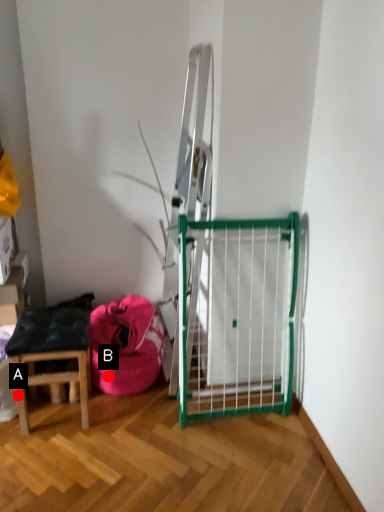
Question: Two points are circled on the image, labeled by A and B beside each circle. Which point is closer to the camera?

Choices:
 (A) A is closer
 (B) B is closer

Answer: (A)